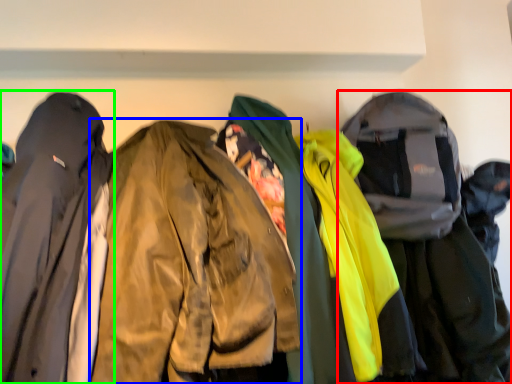
Question: Which object is positioned farthest from jacket (highlighted by a red box)? Select from jacket (highlighted by a blue box) and jacket (highlighted by a green box).

Choices:
 (A) jacket
 (B) jacket

Answer: (B)